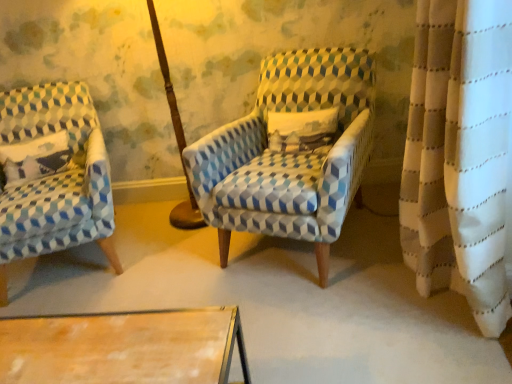
Identify the location of free point below blue and white geometric-patterned armchair at left, positioned as the second chair in right-to-left order (from a real-world perspective). The height and width of the screenshot is (384, 512). (70, 269).